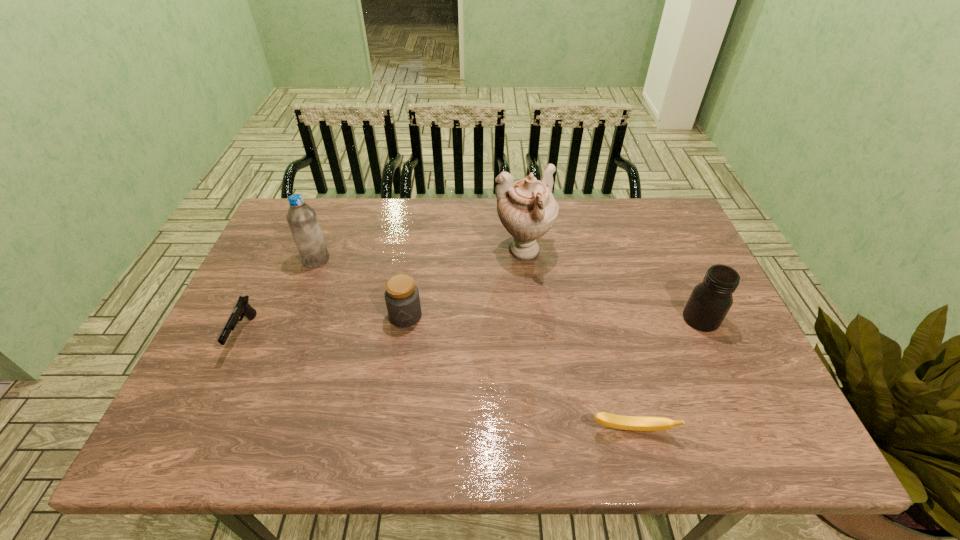
I want to click on gun situated at the left edge, so click(x=242, y=308).

Where is `object present at the right edge`? object present at the right edge is located at coordinates (710, 300).

Find the location of a particular element. The height and width of the screenshot is (540, 960). vacant space at the far edge of the desktop is located at coordinates (612, 201).

What are the coordinates of `vacant space at the near edge` in the screenshot? It's located at (658, 453).

In the image, there is a desktop. Identify the location of free space at the left edge. (273, 309).

You are a GUI agent. You are given a task and a screenshot of the screen. Output one action in this format:
    pyautogui.click(x=<x>, y=<y>)
    Task: Click on the vacant space at the right edge
    The height and width of the screenshot is (540, 960).
    Given the screenshot: What is the action you would take?
    pyautogui.click(x=695, y=357)

Locate an element on the screen. Image resolution: width=960 pixels, height=540 pixels. free space at the far right corner of the desktop is located at coordinates (660, 201).

Find the location of a particular element. This screenshot has height=540, width=960. free space at the near right corner is located at coordinates (800, 454).

At what (x,y) coordinates should I click in order to perform the action: click on free space between the leftmost object and the fifth object from left to right. Please return your answer as a coordinate pair (x, y). Looking at the image, I should click on pyautogui.click(x=438, y=382).

At what (x,y) coordinates should I click in order to perform the action: click on free space between the third tallest object and the left jar. Please return your answer as a coordinate pair (x, y). This screenshot has height=540, width=960. Looking at the image, I should click on (553, 317).